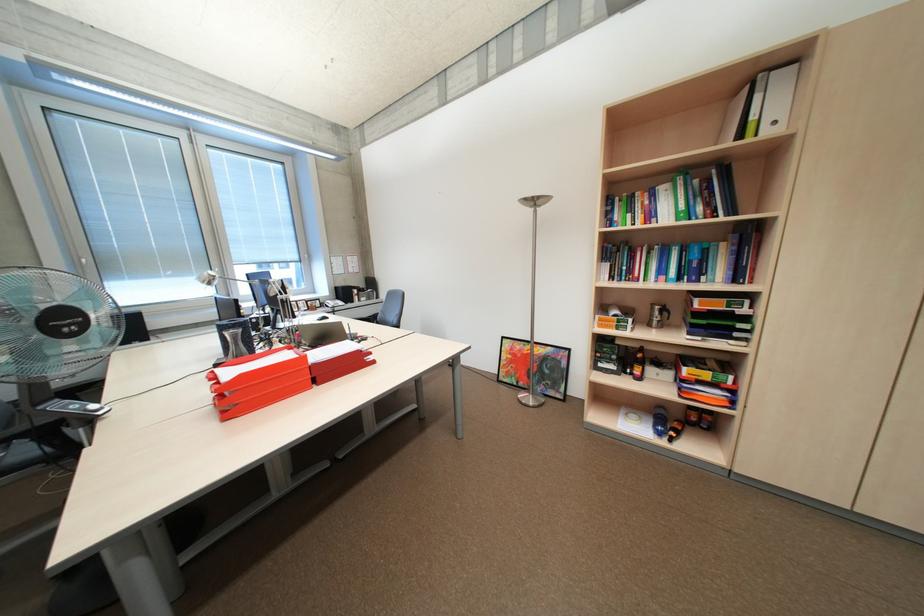
Where is `fan control button`? fan control button is located at coordinates (96, 408).